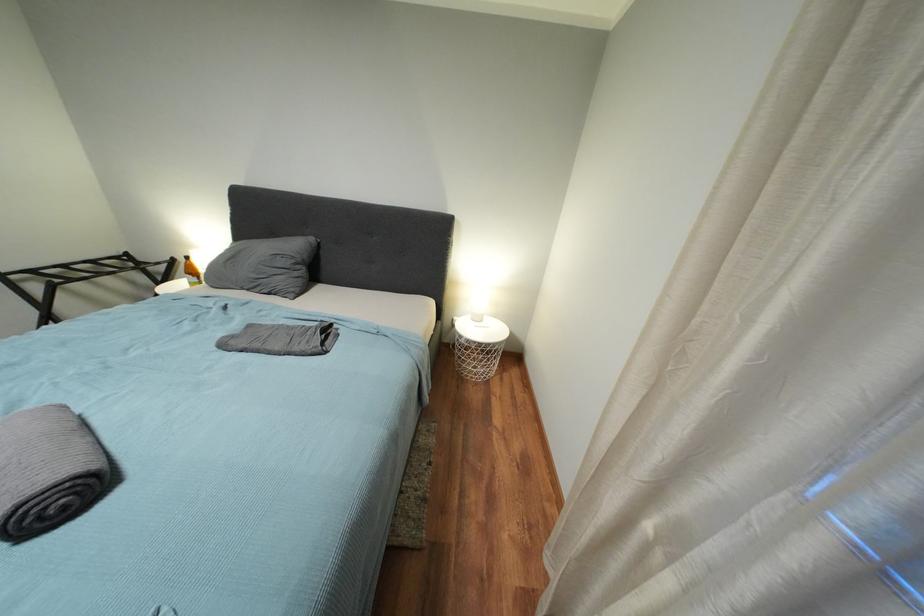
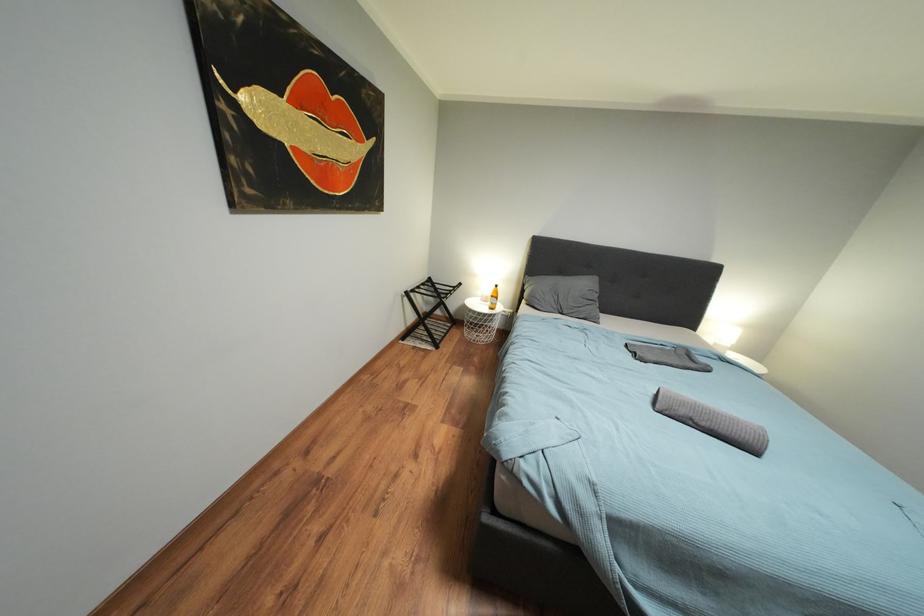
Looking at this image, what movement of the cameraman would produce the second image?

The cameraman walked toward left, backward.